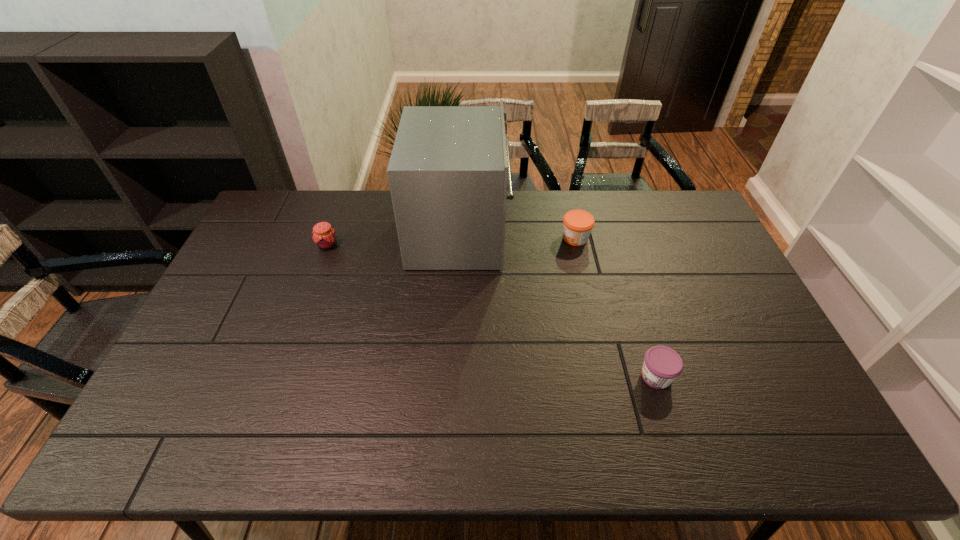
Identify the location of jam that is the second closest to the leftmost jam. This screenshot has height=540, width=960. (662, 365).

This screenshot has height=540, width=960. I want to click on vacant space that satisfies the following two spatial constraints: 1. on the front label of the second jam from left to right; 2. on the front side of the leftmost jam, so click(577, 245).